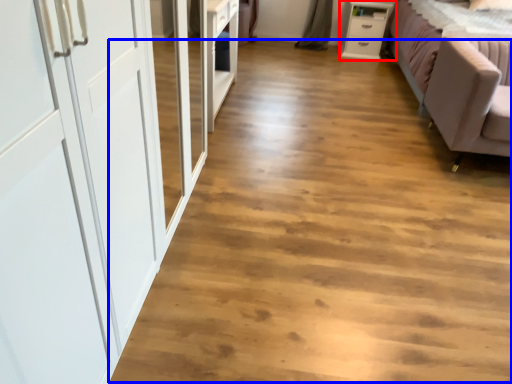
Question: Which of the following is the closest to the observer, chest of drawers (highlighted by a red box) or plain (highlighted by a blue box)?

Choices:
 (A) chest of drawers
 (B) plain

Answer: (B)